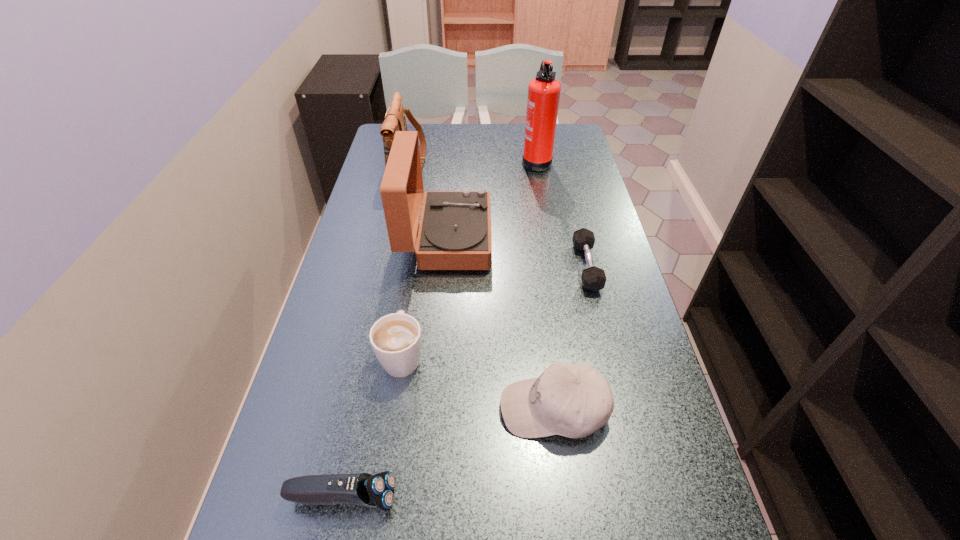
Locate an element on the screen. the tallest object is located at coordinates (543, 91).

You are a GUI agent. You are given a task and a screenshot of the screen. Output one action in this format:
    pyautogui.click(x=<x>, y=<y>)
    Task: Click on the phonograph record
    This screenshot has width=960, height=540.
    Given the screenshot: What is the action you would take?
    pyautogui.click(x=454, y=233)

Identify the location of shoulder bag. The width and height of the screenshot is (960, 540). (395, 120).

Find the location of a particular element. Image resolution: width=960 pixels, height=540 pixels. baseball cap is located at coordinates (572, 400).

Identify the location of cappuccino. (396, 339).

Where is `electric shaver`? This screenshot has height=540, width=960. electric shaver is located at coordinates (363, 489).

The width and height of the screenshot is (960, 540). In order to click on the sixth tallest object in this screenshot , I will do `click(363, 489)`.

Find the location of `the shortest object`. the shortest object is located at coordinates (593, 278).

Locate an element on the screen. the rightmost object is located at coordinates (593, 278).

Where is `free space located 0.230m at the nozzle of the tallest object`? Image resolution: width=960 pixels, height=540 pixels. free space located 0.230m at the nozzle of the tallest object is located at coordinates (457, 160).